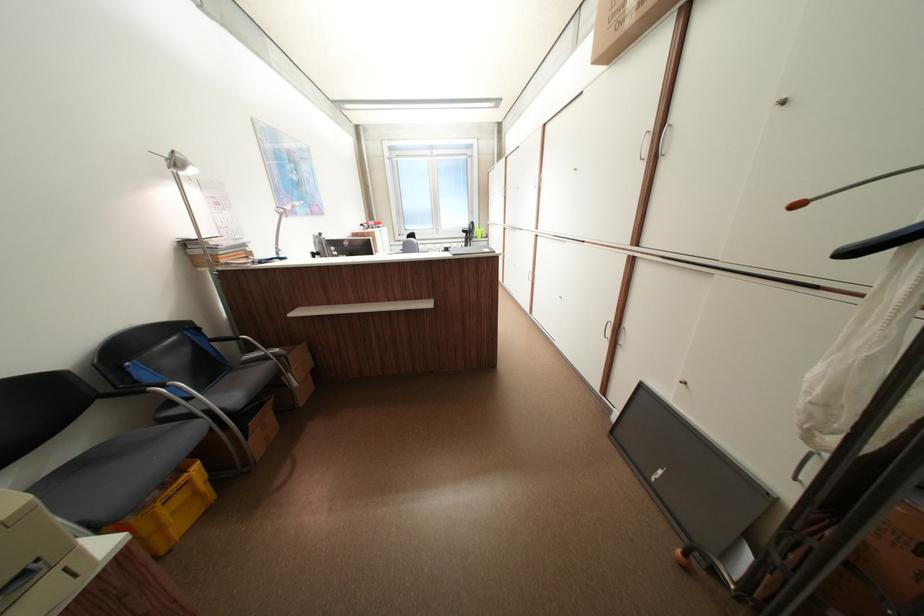
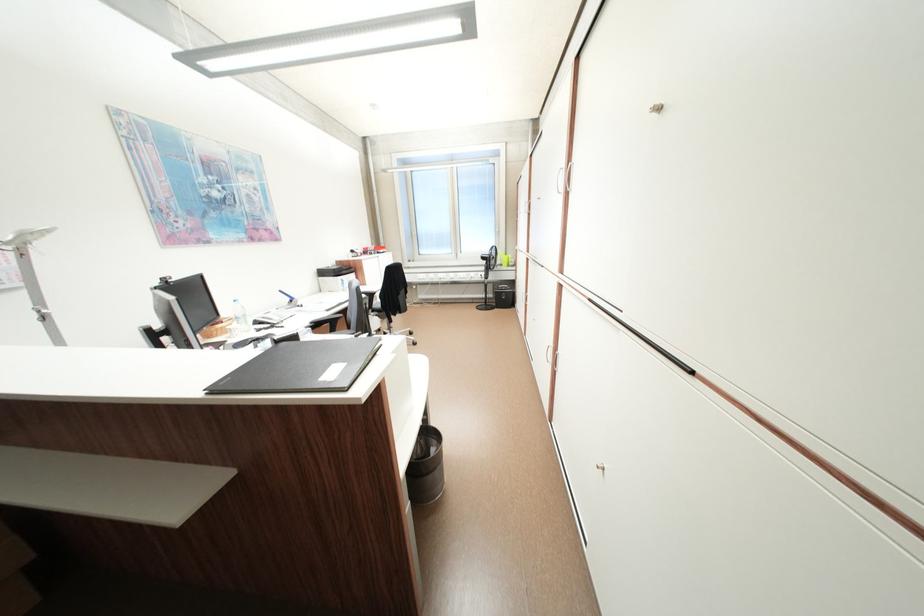
The point at (x=473, y=232) is marked in the first image. Where is the corresponding point in the second image?

(492, 259)